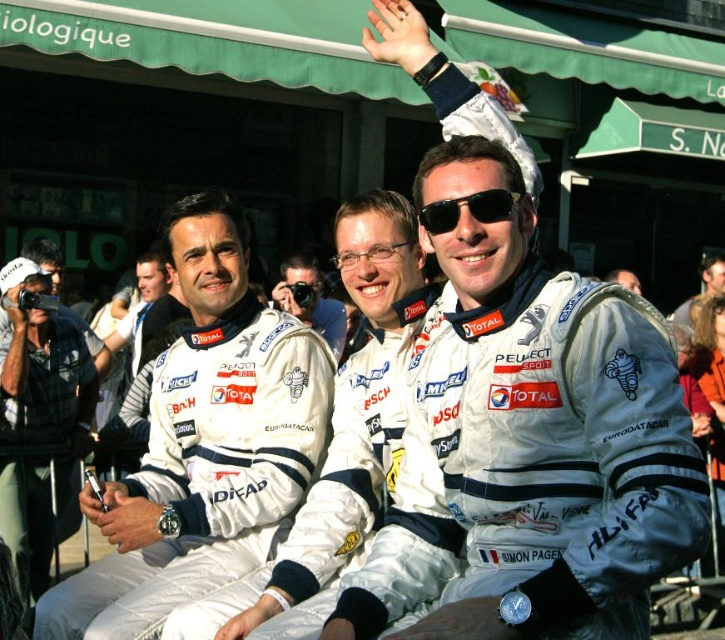
You are a photographer standing in front of the three racers. You want to take a photo that includes both the point at coordinates point (339, 312) and the point at coordinates point (687, 324). Which point will appear larger in your photo?

Point (339, 312) will appear larger in the photo because it is closer to the viewer than point (687, 324).